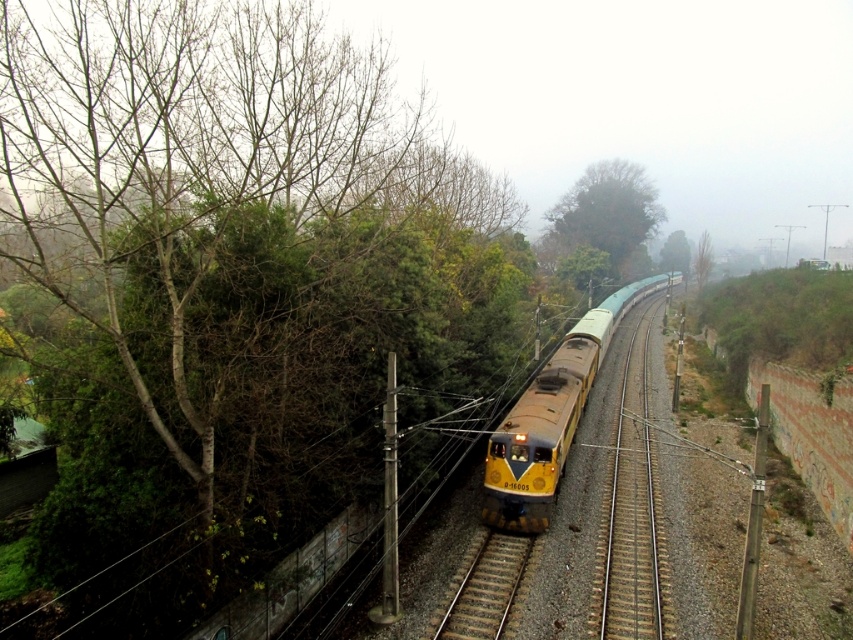
Question: Which point is farther from the camera taking this photo?

Choices:
 (A) (531, 557)
 (B) (612, 314)

Answer: (B)

Question: Can you confirm if green leafy tree at upper center is smaller than brown gravel track at center?

Choices:
 (A) yes
 (B) no

Answer: (B)

Question: Which of the following is the farthest from the observer?

Choices:
 (A) yellow metallic train at center
 (B) brown gravel track at center
 (C) green leafy tree at upper center

Answer: (C)

Question: Does yellow metallic train at center have a lesser width compared to brown gravel track at center?

Choices:
 (A) no
 (B) yes

Answer: (A)

Question: Which point is farther to the camera?

Choices:
 (A) green leafy tree at upper center
 (B) yellow metallic train at center

Answer: (A)

Question: Is yellow metallic train at center to the right of brown gravel track at center from the viewer's perspective?

Choices:
 (A) yes
 (B) no

Answer: (A)